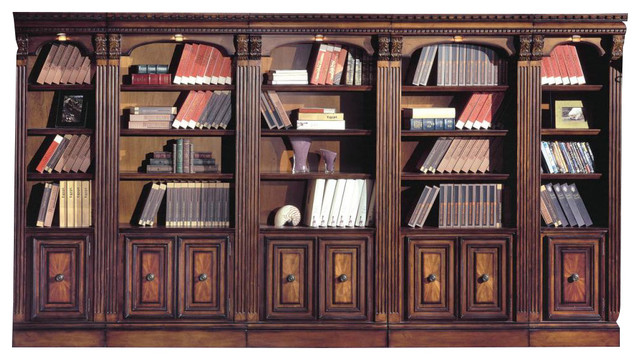
Image resolution: width=640 pixels, height=360 pixels. I want to click on decorations, so click(276, 208), click(301, 162), click(328, 159), click(568, 118), click(64, 105).